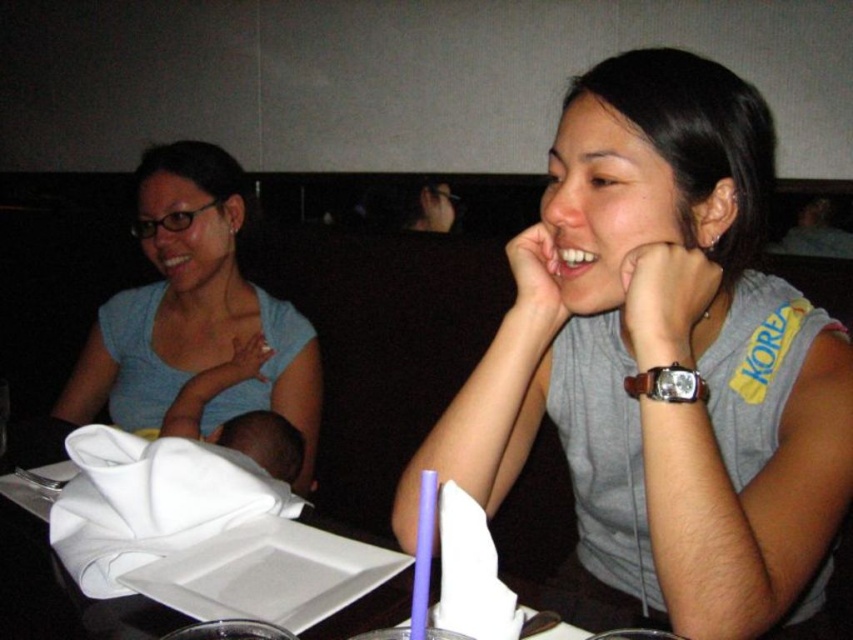
Measure the distance from gray fabric shirt at center to matte blue shirt at left.

gray fabric shirt at center and matte blue shirt at left are 34.02 inches apart.

Which is above, gray fabric shirt at center or matte blue shirt at left?

matte blue shirt at left is higher up.

Between point (712, 269) and point (285, 406), which one is positioned in front?

Point (712, 269) is more forward.

Find the location of a particular element. gray fabric shirt at center is located at coordinates (662, 365).

Does point (125, 317) lie in front of point (44, 492)?

No, it is not.

Is matte blue shirt at left shorter than white paper napkin at center?

Incorrect, matte blue shirt at left's height does not fall short of white paper napkin at center's.

Find the location of a particular element. matte blue shirt at left is located at coordinates pyautogui.click(x=195, y=317).

Who is positioned more to the left, gray fabric shirt at center or white paper napkin at center?

white paper napkin at center is more to the left.

Looking at this image, is gray fabric shirt at center smaller than white paper napkin at center?

Incorrect, gray fabric shirt at center is not smaller in size than white paper napkin at center.

Find the location of `gray fabric shirt at center`. gray fabric shirt at center is located at coordinates (662, 365).